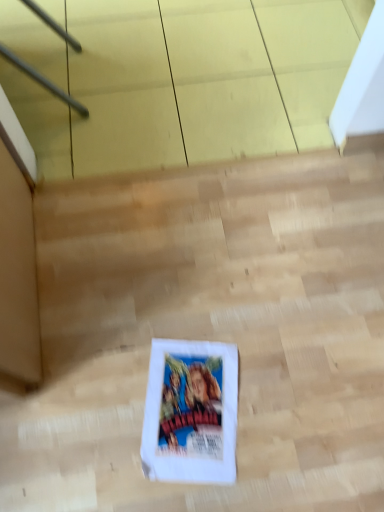
Image resolution: width=384 pixels, height=512 pixels. What are the coordinates of `free spot to the right of white paper comic book at center` in the screenshot? It's located at (290, 408).